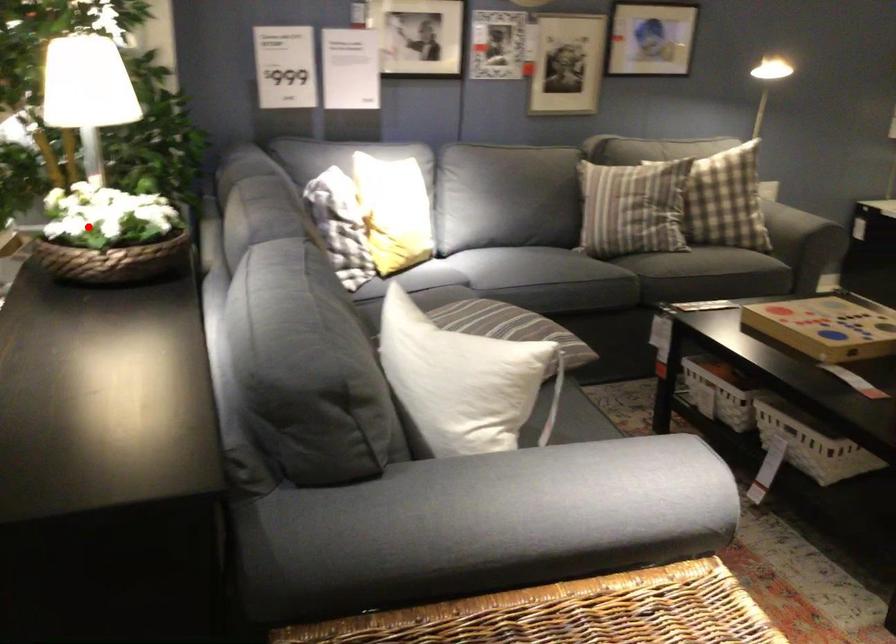
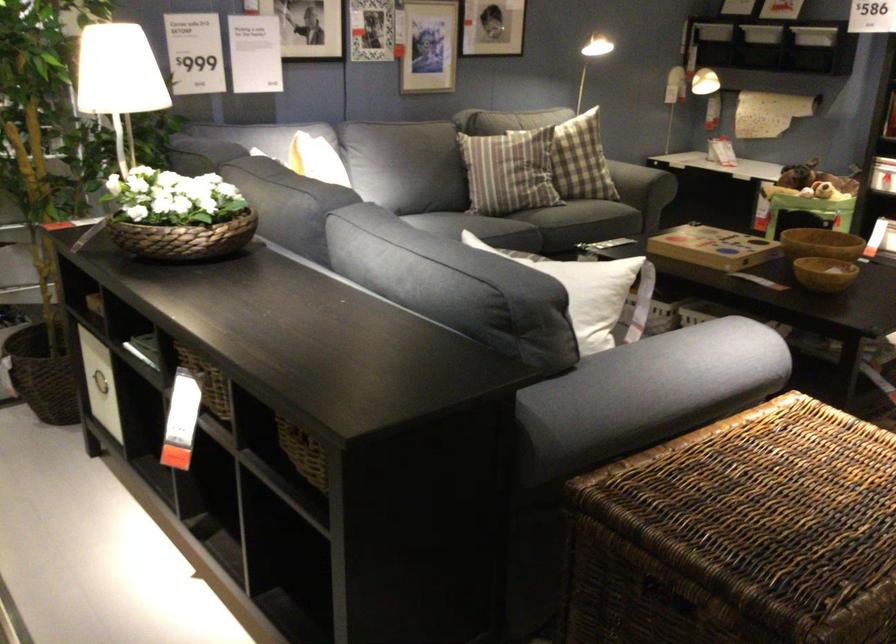
The point at the highlighted location is marked in the first image. Where is the corresponding point in the second image?

(177, 216)